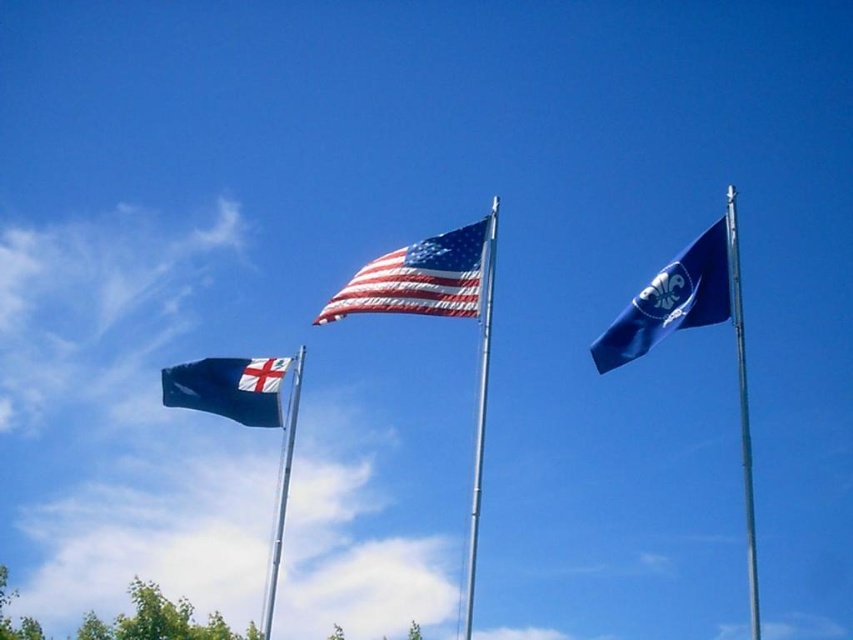
You are an observer standing in front of the three flags. You notice the blue fabric flag at upper right and the silver metallic flag pole at center. Which object takes up more space in the image?

The blue fabric flag at upper right is larger in size than the silver metallic flag pole at center, so it takes up more space in the image.

You are standing at the base of the silver metallic flag pole at center. You want to walk to the nearest flag pole. Which one should you walk towards?

The nearest flag pole is the silver metallic flag pole at center because it is the closest to you as you are already standing at its base.

You are standing in front of the flags and want to hang a new flag that requires a flag pole taller than the blue fabric flag at upper right. Can the silver metallic flag pole at center accommodate this requirement?

The blue fabric flag at upper right has a lesser height compared to the silver metallic flag pole at center, so yes, the silver metallic flag pole at center is taller and can accommodate the new flag requiring a taller pole than the blue fabric flag at upper right.